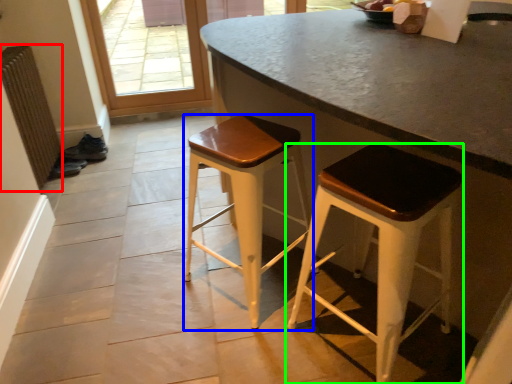
Question: Estimate the real-world distances between objects in this image. Which object is farther from radiator (highlighted by a red box), stool (highlighted by a blue box) or stool (highlighted by a green box)?

Choices:
 (A) stool
 (B) stool

Answer: (B)